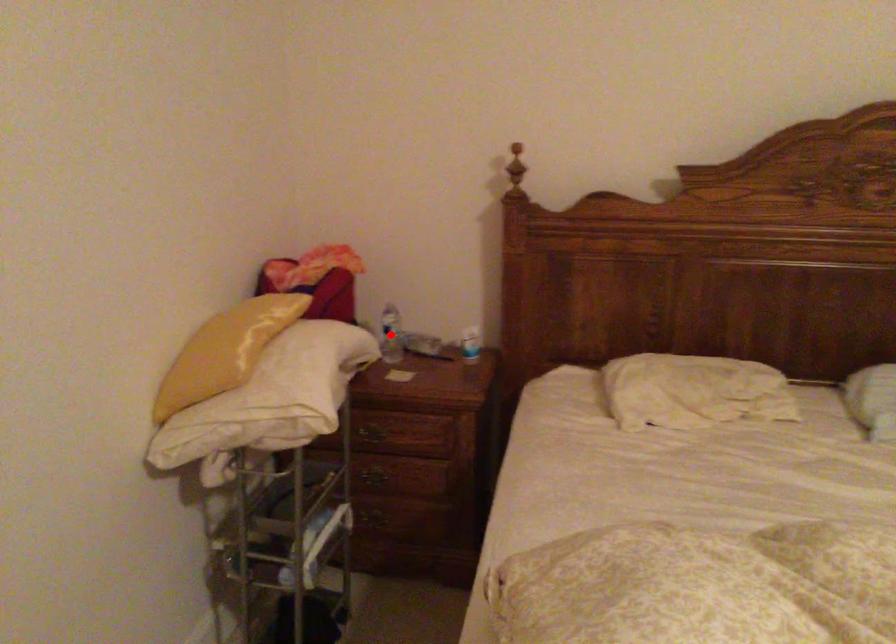
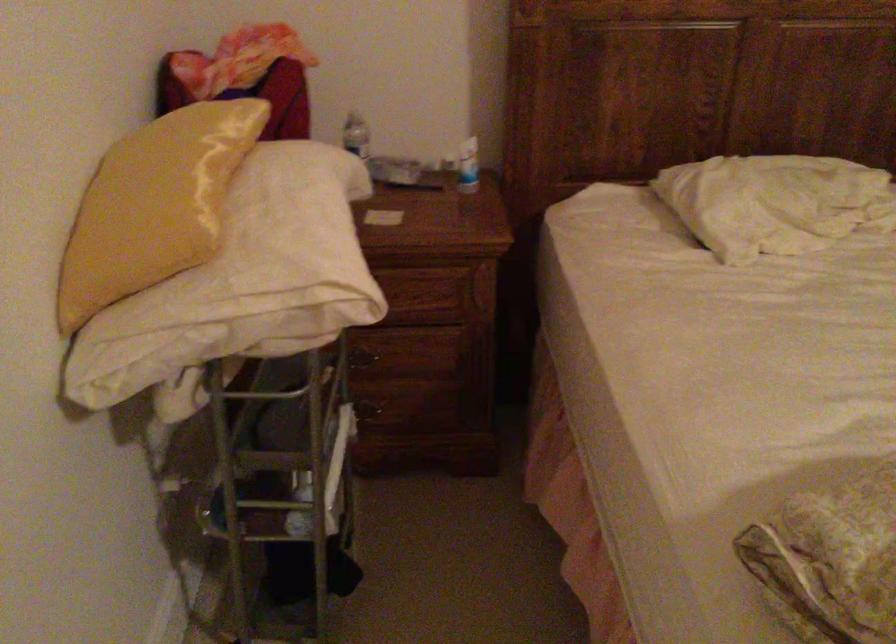
Question: I am providing you with two images of the same scene from different viewpoints. A red point is marked on the first image. At the location where the point appears in image 1, is it still visible in image 2?

Choices:
 (A) Yes
 (B) No

Answer: (B)